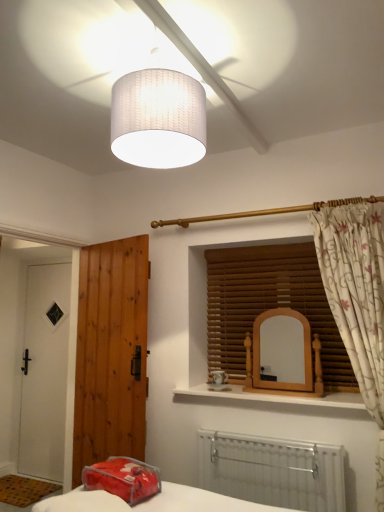
Question: Considering the relative sizes of translucent plastic pillow at lower center and floral fabric curtain at right in the image provided, is translucent plastic pillow at lower center wider than floral fabric curtain at right?

Choices:
 (A) no
 (B) yes

Answer: (B)

Question: Does translucent plastic pillow at lower center turn towards floral fabric curtain at right?

Choices:
 (A) no
 (B) yes

Answer: (A)

Question: From the image's perspective, would you say translucent plastic pillow at lower center is shown under floral fabric curtain at right?

Choices:
 (A) yes
 (B) no

Answer: (A)

Question: Considering the relative sizes of translucent plastic pillow at lower center and floral fabric curtain at right in the image provided, is translucent plastic pillow at lower center shorter than floral fabric curtain at right?

Choices:
 (A) no
 (B) yes

Answer: (B)

Question: Considering the relative positions of translucent plastic pillow at lower center and floral fabric curtain at right in the image provided, is translucent plastic pillow at lower center to the right of floral fabric curtain at right from the viewer's perspective?

Choices:
 (A) yes
 (B) no

Answer: (B)

Question: Do you think white metallic radiator at lower center is within white matte door at left, marked as the 2th door in a front-to-back arrangement, or outside of it?

Choices:
 (A) outside
 (B) inside

Answer: (A)

Question: Considering the positions of white metallic radiator at lower center and white matte door at left, which is the first door from left to right, in the image, is white metallic radiator at lower center wider or thinner than white matte door at left, which is the first door from left to right,?

Choices:
 (A) wide
 (B) thin

Answer: (A)

Question: Is white metallic radiator at lower center in front of or behind white matte door at left, marked as the 2th door in a front-to-back arrangement, in the image?

Choices:
 (A) front
 (B) behind

Answer: (A)

Question: Considering the positions of white metallic radiator at lower center and white matte door at left, marked as the 2th door in a front-to-back arrangement, in the image, is white metallic radiator at lower center bigger or smaller than white matte door at left, marked as the 2th door in a front-to-back arrangement,?

Choices:
 (A) small
 (B) big

Answer: (A)

Question: Would you say white textured lampshade at upper center is to the left or to the right of white matte door at left, which ranks as the second door in right-to-left order, in the picture?

Choices:
 (A) left
 (B) right

Answer: (B)

Question: From the image's perspective, is white textured lampshade at upper center located above or below white matte door at left, marked as the 2th door in a front-to-back arrangement?

Choices:
 (A) above
 (B) below

Answer: (A)

Question: Is white textured lampshade at upper center inside or outside of white matte door at left, marked as the 2th door in a front-to-back arrangement?

Choices:
 (A) inside
 (B) outside

Answer: (B)

Question: Looking at their shapes, would you say white textured lampshade at upper center is wider or thinner than white matte door at left, which appears as the first door when viewed from the back?

Choices:
 (A) wide
 (B) thin

Answer: (A)

Question: Is wooden mirror at center inside the boundaries of white textured lampshade at upper center, or outside?

Choices:
 (A) outside
 (B) inside

Answer: (A)

Question: Based on their sizes in the image, would you say wooden mirror at center is bigger or smaller than white textured lampshade at upper center?

Choices:
 (A) big
 (B) small

Answer: (B)